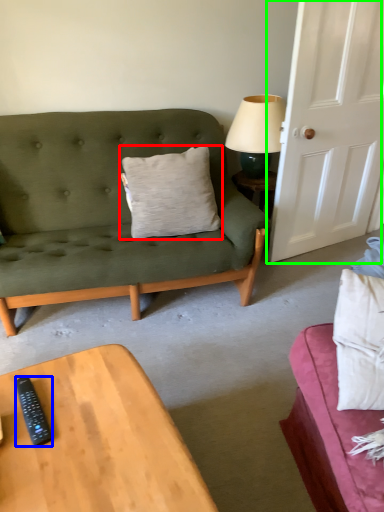
Question: Which object is the farthest from pillow (highlighted by a red box)? Choose among these: remote control (highlighted by a blue box) or door (highlighted by a green box).

Choices:
 (A) remote control
 (B) door

Answer: (A)